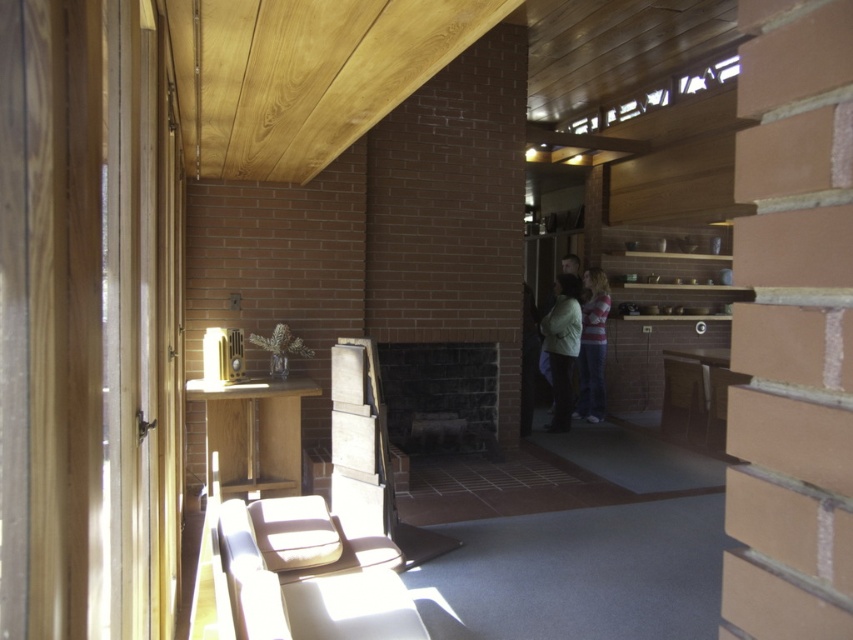
Question: Among these points, which one is farthest from the camera?

Choices:
 (A) (573, 301)
 (B) (602, 324)

Answer: (B)

Question: Is wooden plank ceiling at upper center above light beige sweater at center?

Choices:
 (A) no
 (B) yes

Answer: (B)

Question: Which of the following is the closest to the observer?

Choices:
 (A) (592, 342)
 (B) (184, 84)

Answer: (B)

Question: Is wooden plank ceiling at upper center wider than light beige sweater at center?

Choices:
 (A) yes
 (B) no

Answer: (A)

Question: Which object is positioned farthest from the light beige sweater at center?

Choices:
 (A) wooden plank ceiling at upper center
 (B) striped cotton shirt at center

Answer: (A)

Question: Considering the relative positions of wooden plank ceiling at upper center and light beige sweater at center in the image provided, where is wooden plank ceiling at upper center located with respect to light beige sweater at center?

Choices:
 (A) above
 (B) below

Answer: (A)